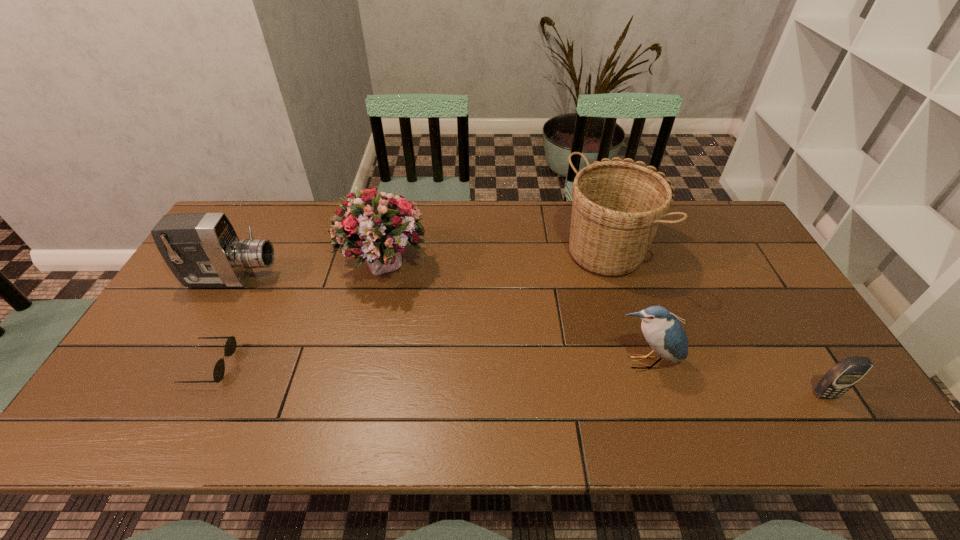
Image resolution: width=960 pixels, height=540 pixels. In order to click on vacant area at the right edge of the desktop in this screenshot , I will do `click(792, 335)`.

Image resolution: width=960 pixels, height=540 pixels. Identify the location of free space at the far right corner. point(726,215).

Where is `vacant area that lies between the sunglasses and the basket`? This screenshot has height=540, width=960. vacant area that lies between the sunglasses and the basket is located at coordinates (413, 305).

Find the location of a particular element. free point between the nearest object and the shortest object is located at coordinates (517, 380).

The height and width of the screenshot is (540, 960). Find the location of `vacant area between the bird and the sunglasses`. vacant area between the bird and the sunglasses is located at coordinates (427, 363).

The image size is (960, 540). What are the coordinates of `empty location between the shortest object and the basket` in the screenshot? It's located at (413, 305).

Locate an element on the screen. vacant region between the bird and the basket is located at coordinates (630, 304).

Where is `vacant area that lies between the bird and the shortest object`? This screenshot has height=540, width=960. vacant area that lies between the bird and the shortest object is located at coordinates (427, 363).

At what (x,y) coordinates should I click in order to perform the action: click on vacant space that's between the rightmost object and the bird. Please return your answer as a coordinate pair (x, y). Looking at the image, I should click on (x=734, y=379).

Find the location of a particular element. vacant space that's between the cellular telephone and the basket is located at coordinates (720, 320).